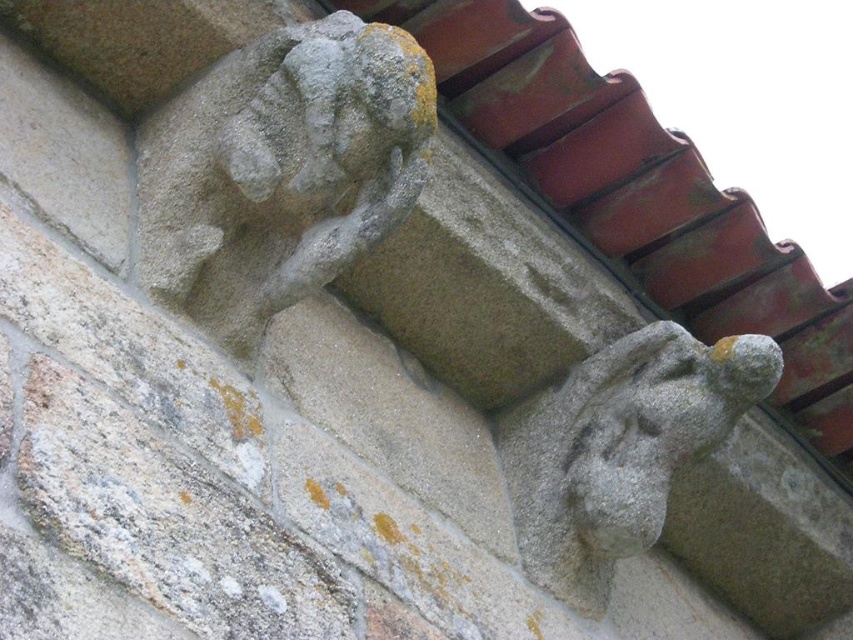
Who is lower down, gray stone gargoyle at upper left or gray stone gargoyle at lower right?

gray stone gargoyle at lower right

The width and height of the screenshot is (853, 640). I want to click on gray stone gargoyle at upper left, so click(x=280, y=172).

Identify the location of gray stone gargoyle at upper left. The width and height of the screenshot is (853, 640). (280, 172).

This screenshot has width=853, height=640. I want to click on gray stone gargoyle at upper left, so click(280, 172).